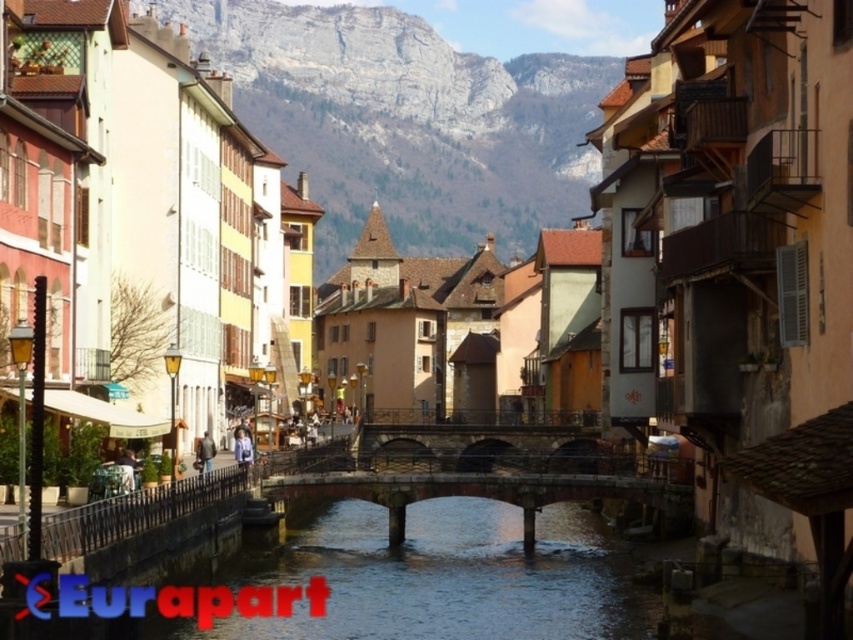
You are a tourist standing at the edge of the canal in the quaint European town. You want to take a photo that includes both the rocky gray mountain at center and the stone bridge at center. Which object should you position closer to the edge of the frame to ensure both are fully visible in your shot?

Since the rocky gray mountain at center is larger than the stone bridge at center, you should position the stone bridge at center closer to the edge of the frame to ensure both objects fit within the photo.